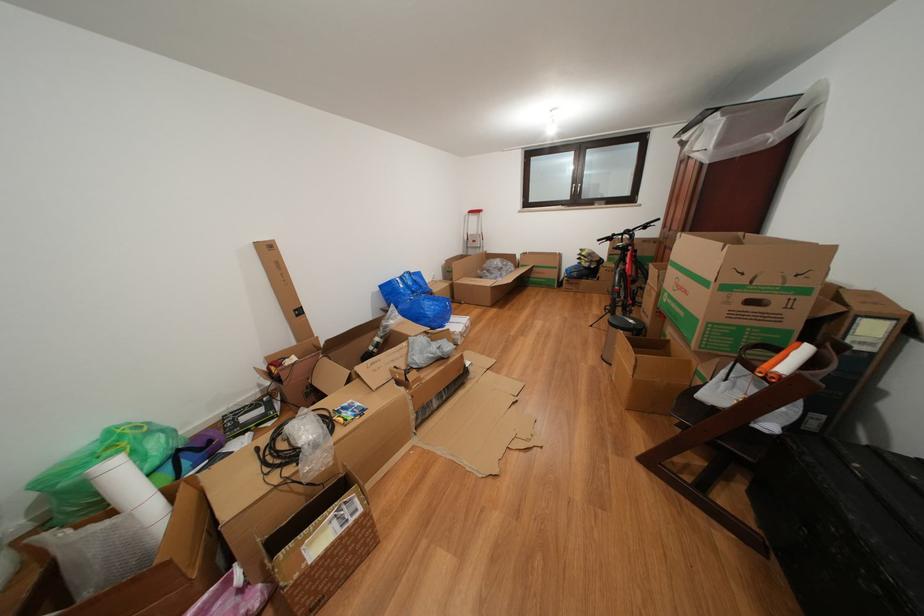
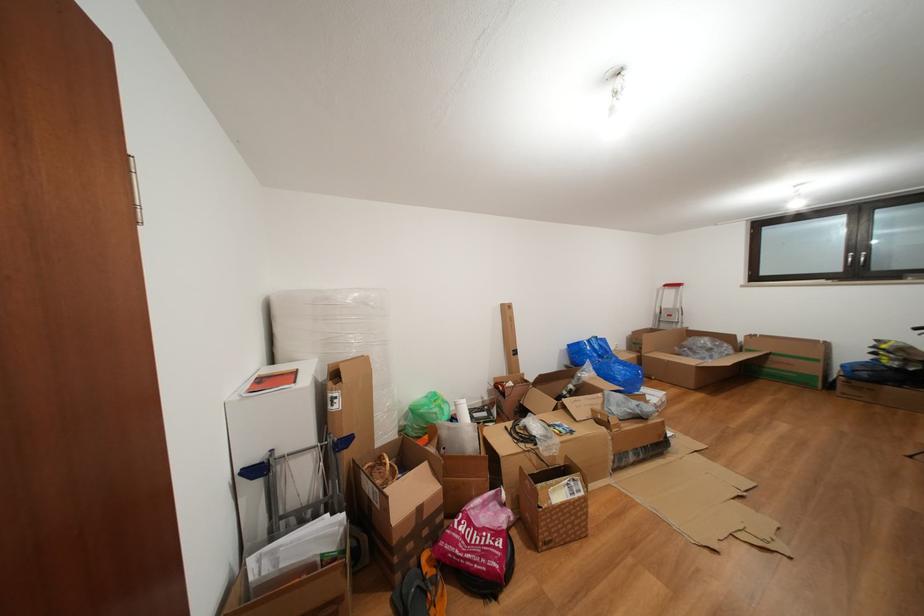
Where in the second image is the point corresponding to [478,217] from the first image?

(674, 291)